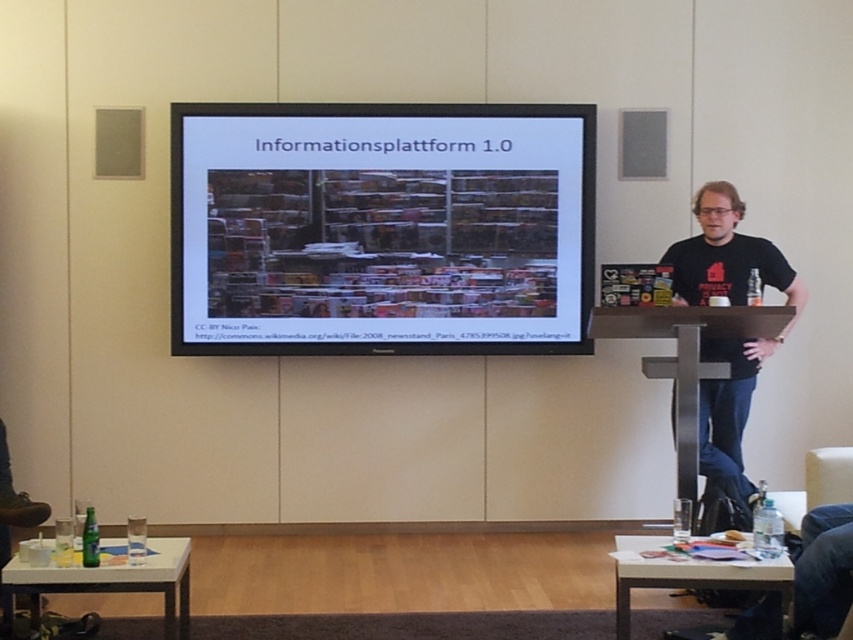
From the picture: Is the position of matte plastic projection screen at center more distant than that of black t-shirt at center?

Yes, matte plastic projection screen at center is behind black t-shirt at center.

Is matte plastic projection screen at center below black t-shirt at center?

No, matte plastic projection screen at center is not below black t-shirt at center.

I want to click on matte plastic projection screen at center, so click(x=381, y=228).